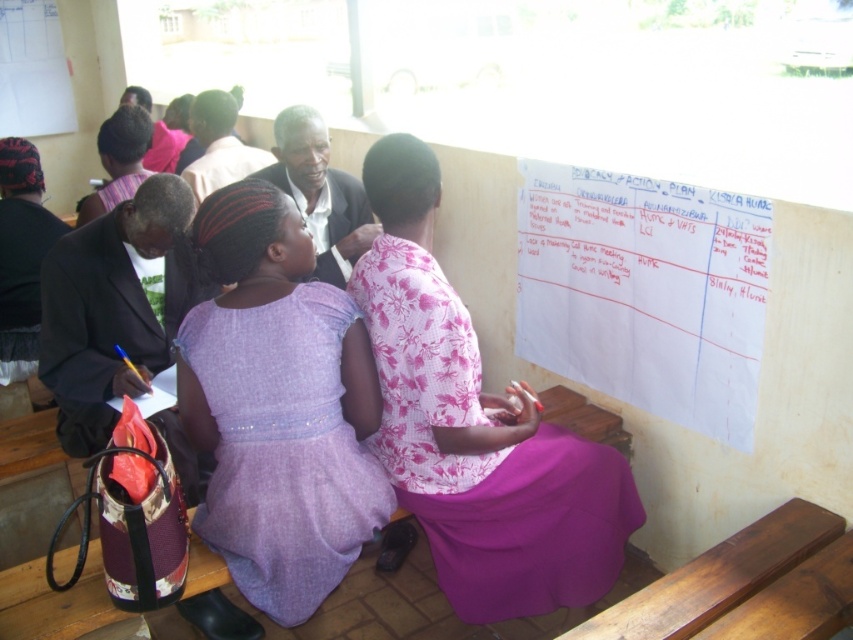
Does pink floral fabric dress at center have a smaller size compared to white paperboard at upper center?

Yes, pink floral fabric dress at center is smaller than white paperboard at upper center.

Between pink floral fabric dress at center and white paperboard at upper center, which one is positioned lower?

Positioned lower is pink floral fabric dress at center.

Where is `pink floral fabric dress at center`? This screenshot has width=853, height=640. pink floral fabric dress at center is located at coordinates (474, 428).

Find the location of `pink floral fabric dress at center`. pink floral fabric dress at center is located at coordinates (474, 428).

Is pink floral fabric dress at center in front of purple satin dress at center?

No, pink floral fabric dress at center is behind purple satin dress at center.

Between point (618, 564) and point (202, 536), which one is positioned in front?

Point (202, 536)

The width and height of the screenshot is (853, 640). I want to click on pink floral fabric dress at center, so click(x=474, y=428).

Is white paperboard at upper center shorter than purple satin dress at center?

No, white paperboard at upper center is not shorter than purple satin dress at center.

Can you confirm if white paperboard at upper center is positioned to the right of purple satin dress at center?

Indeed, white paperboard at upper center is positioned on the right side of purple satin dress at center.

Who is more forward, [718,289] or [299,346]?

Positioned in front is point [299,346].

Find the location of `white paperboard at upper center`. white paperboard at upper center is located at coordinates (645, 291).